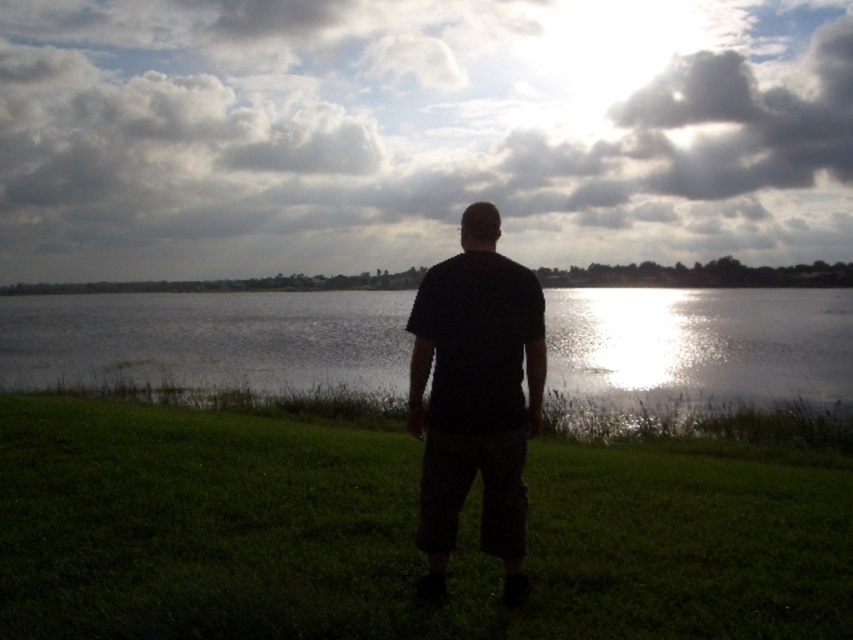
You are a photographer trying to capture the cloudy sky at upper center and the black matte shirt at center in the same frame. Based on their positions, which object should you adjust your camera to focus on first to ensure both are in the shot?

The cloudy sky at upper center is to the left of the black matte shirt at center, so you should focus on the cloudy sky at upper center first to ensure both are included in the frame.